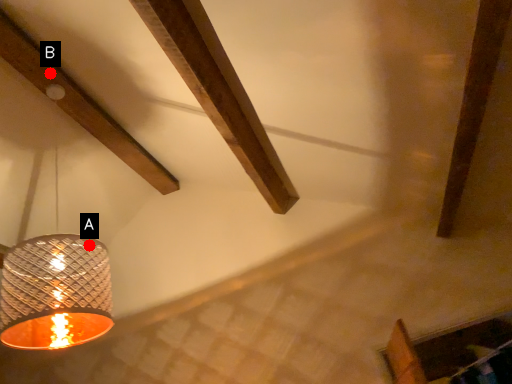
Question: Two points are circled on the image, labeled by A and B beside each circle. Which point is closer to the camera?

Choices:
 (A) A is closer
 (B) B is closer

Answer: (A)